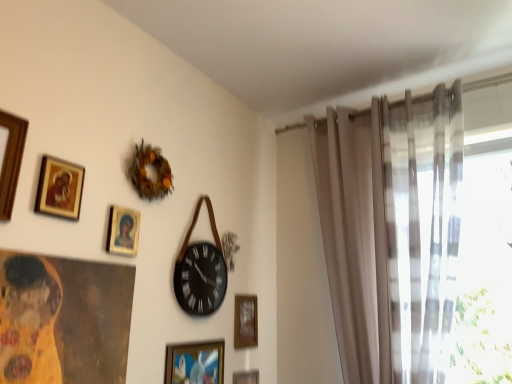
Question: Considering the positions of wooden picture frame at center, marked as the third picture frame in a bottom-to-top arrangement, and wooden picture frame at upper left, which ranks as the sixth picture frame in right-to-left order, in the image, is wooden picture frame at center, marked as the third picture frame in a bottom-to-top arrangement, taller or shorter than wooden picture frame at upper left, which ranks as the sixth picture frame in right-to-left order,?

Choices:
 (A) tall
 (B) short

Answer: (B)

Question: From the image's perspective, is wooden picture frame at center, marked as the third picture frame in a bottom-to-top arrangement, located above or below wooden picture frame at upper left, which ranks as the sixth picture frame in right-to-left order?

Choices:
 (A) above
 (B) below

Answer: (B)

Question: Which is farther from the wooden picture frame at center, marked as the first picture frame in a right-to-left arrangement?

Choices:
 (A) gold-framed picture at upper left, positioned as the 2th picture frame in top-to-bottom order
 (B) black leather wall clock at center
 (C) matte gold picture frame at upper center, the fourth picture frame positioned from the right
 (D) wooden picture frame at upper left, which ranks as the 6th picture frame in bottom-to-top order
 (E) sheer beige curtain at right

Answer: (D)

Question: Estimate the real-world distances between objects in this image. Which object is closer to the gold-framed picture at upper left, arranged as the 5th picture frame when ordered from the bottom?

Choices:
 (A) wooden picture frame at center, marked as the third picture frame in a bottom-to-top arrangement
 (B) matte gold picture frame at upper center, positioned as the fourth picture frame in bottom-to-top order
 (C) metallic gold picture frame at lower center, acting as the 2th picture frame starting from the back
 (D) black leather wall clock at center
 (E) wooden picture frame at upper left, which ranks as the sixth picture frame in right-to-left order

Answer: (E)